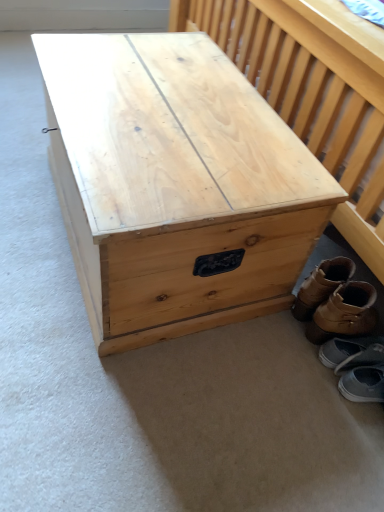
Identify the location of vacant area on top of natural wood trunk at center (from a real-world perspective). This screenshot has width=384, height=512. (175, 106).